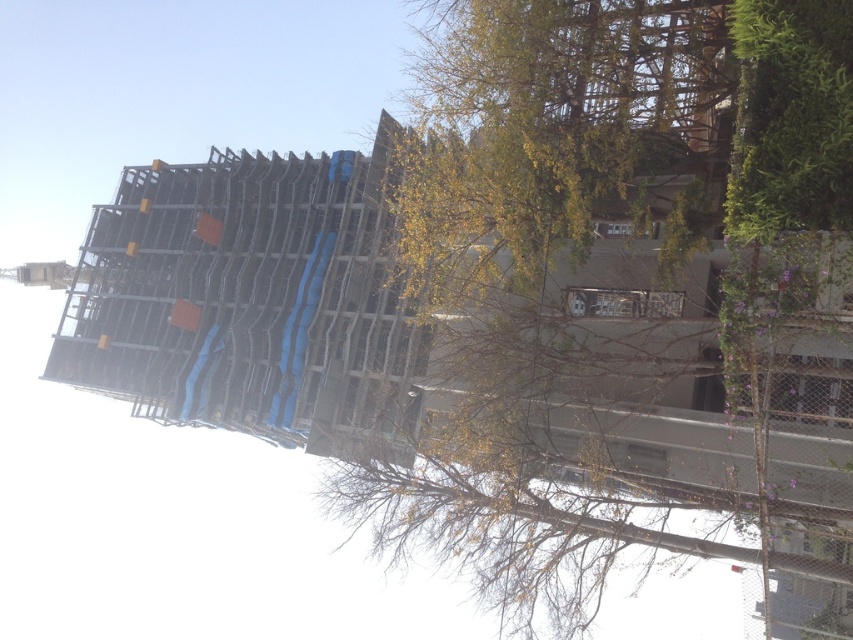
Question: Does green leafy tree at upper center come behind metal chain-link fence at right?

Choices:
 (A) yes
 (B) no

Answer: (B)

Question: Is green leafy tree at upper center smaller than metal chain-link fence at right?

Choices:
 (A) no
 (B) yes

Answer: (A)

Question: Which of the following is the closest to the observer?

Choices:
 (A) (787, 448)
 (B) (428, 490)

Answer: (A)

Question: In this image, where is green leafy tree at upper center located relative to metal chain-link fence at right?

Choices:
 (A) above
 (B) below

Answer: (A)

Question: Which point is farther to the camera?

Choices:
 (A) (807, 356)
 (B) (680, 413)

Answer: (B)